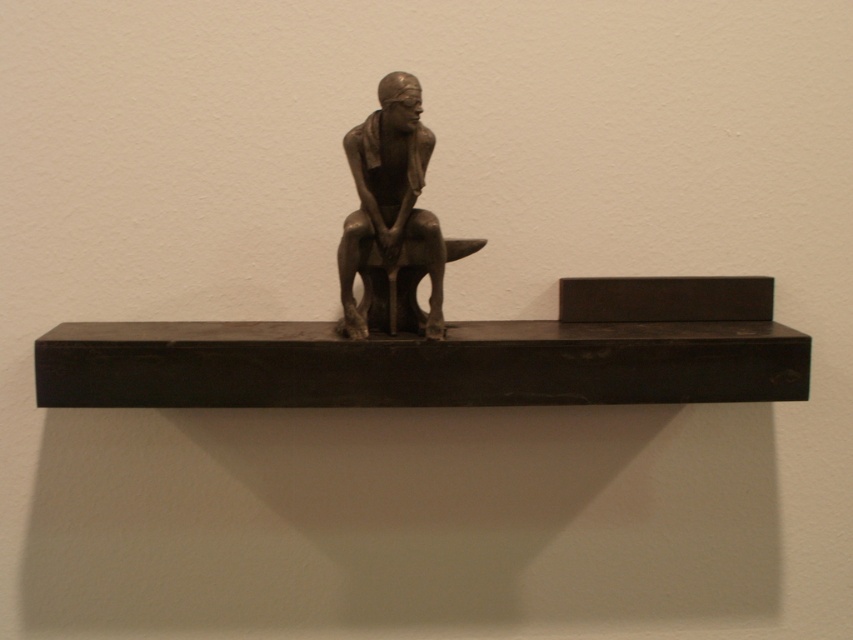
Question: Which point is farther to the camera?

Choices:
 (A) tap(393, 209)
 (B) tap(294, 360)

Answer: (A)

Question: Does black wood shelf at center lie in front of bronze statue at center?

Choices:
 (A) no
 (B) yes

Answer: (B)

Question: Is black wood shelf at center to the right of bronze statue at center from the viewer's perspective?

Choices:
 (A) no
 (B) yes

Answer: (B)

Question: Does black wood shelf at center lie behind bronze statue at center?

Choices:
 (A) yes
 (B) no

Answer: (B)

Question: Which of the following is the closest to the observer?

Choices:
 (A) bronze statue at center
 (B) black wood shelf at center

Answer: (B)